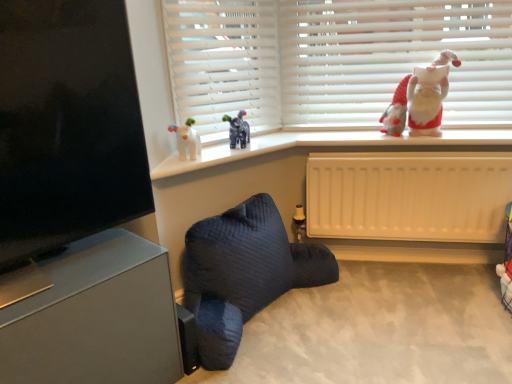
The image size is (512, 384). I want to click on vacant space underneath dark blue quilted bean bag chair at lower center (from a real-world perspective), so click(x=276, y=311).